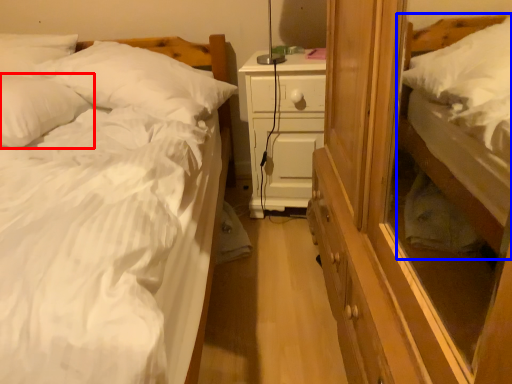
Question: Which of the following is the farthest to the observer, pillow (highlighted by a red box) or bed (highlighted by a blue box)?

Choices:
 (A) pillow
 (B) bed

Answer: (B)